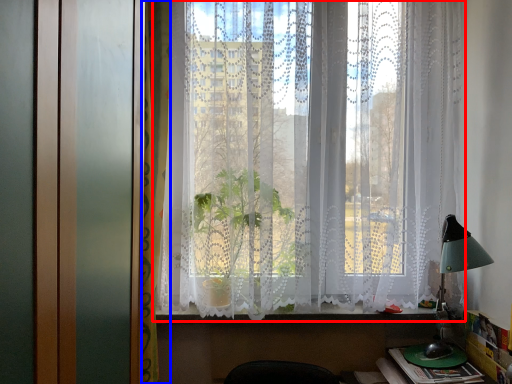
Question: Which of the following is the farthest to the observer, window (highlighted by a red box) or curtain (highlighted by a blue box)?

Choices:
 (A) window
 (B) curtain

Answer: (A)